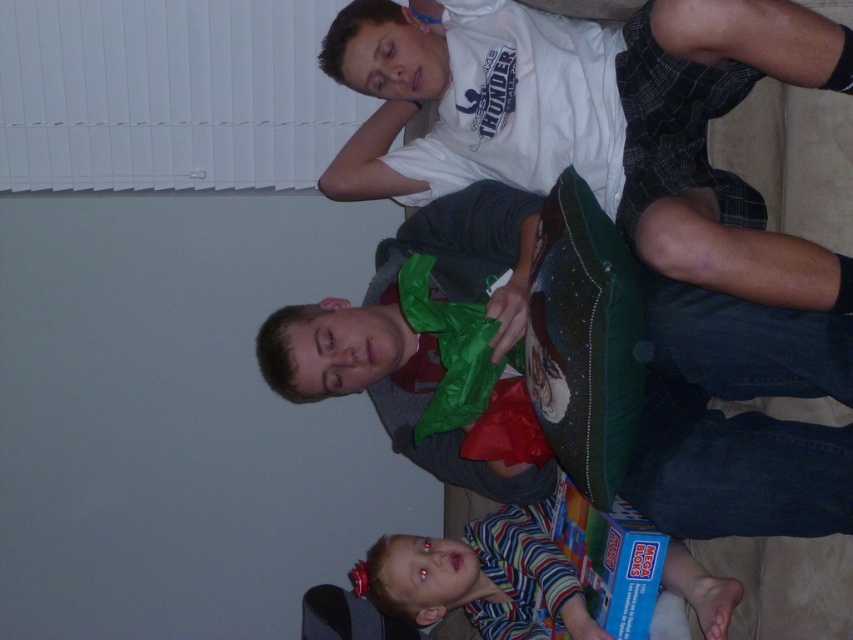
Question: Does white cotton shirt at upper center appear on the right side of striped fabric shirt at lower center?

Choices:
 (A) yes
 (B) no

Answer: (A)

Question: Which of the following is the farthest from the observer?

Choices:
 (A) (547, 560)
 (B) (743, 346)
 (C) (604, 561)

Answer: (A)

Question: Among these points, which one is farthest from the camera?

Choices:
 (A) (434, 605)
 (B) (376, 112)
 (C) (643, 552)
 (D) (819, 380)

Answer: (B)

Question: Does striped fabric shirt at lower center have a lesser width compared to blue cardboard box at lower center?

Choices:
 (A) yes
 (B) no

Answer: (B)

Question: Which object appears closest to the camera in this image?

Choices:
 (A) matte green pillow at center
 (B) blue cardboard box at lower center
 (C) white cotton shirt at upper center

Answer: (C)

Question: Is matte green pillow at center bigger than striped fabric shirt at lower center?

Choices:
 (A) no
 (B) yes

Answer: (B)